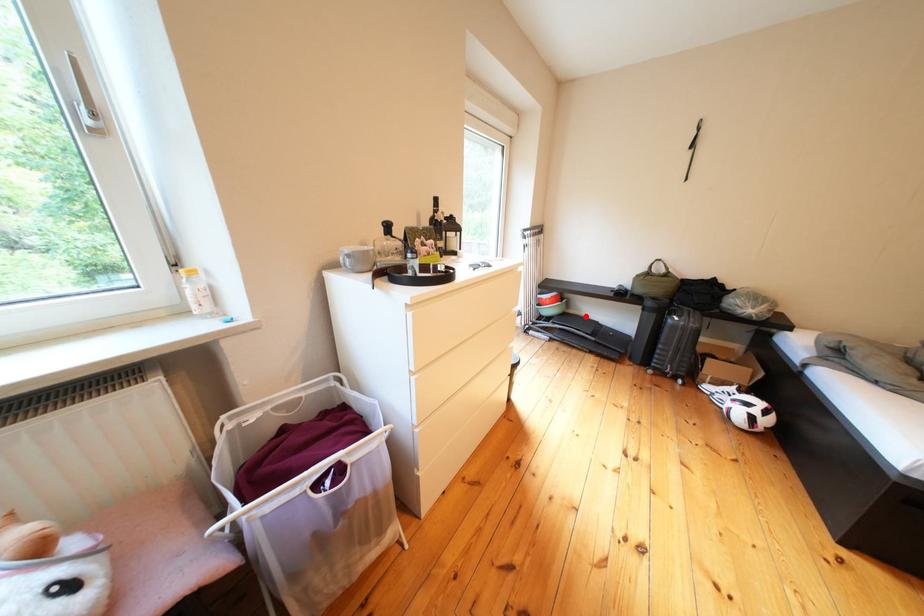
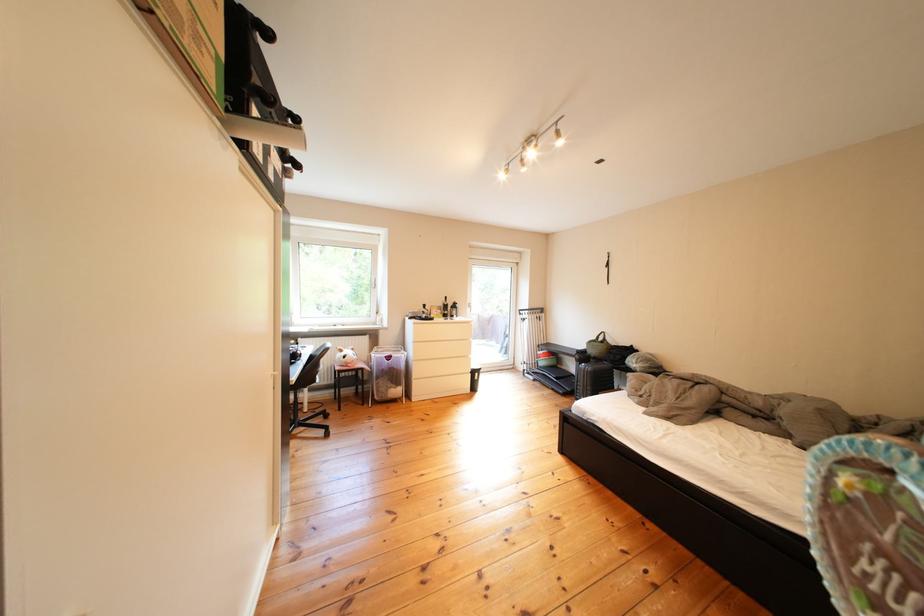
In the second image, find the point that corresponds to the highlighted location in the first image.

(578, 371)